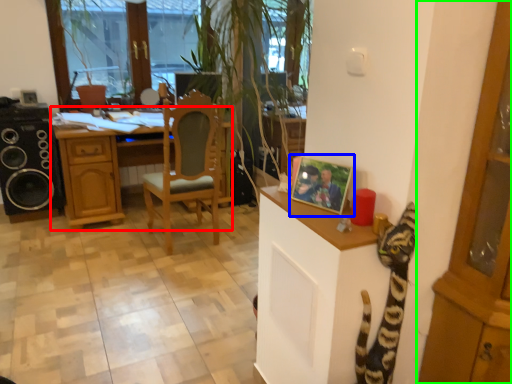
Question: Which object is the farthest from desk (highlighted by a red box)? Choose among these: picture frame (highlighted by a blue box) or cabinetry (highlighted by a green box).

Choices:
 (A) picture frame
 (B) cabinetry

Answer: (B)